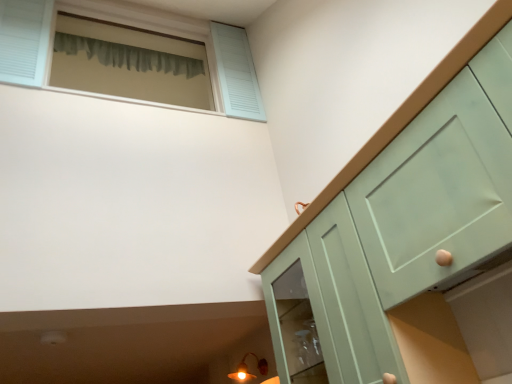
Question: Considering the positions of light blue wooden window at upper left and mint green cabinet at right in the image, is light blue wooden window at upper left bigger or smaller than mint green cabinet at right?

Choices:
 (A) small
 (B) big

Answer: (B)

Question: Is light blue wooden window at upper left inside the boundaries of mint green cabinet at right, or outside?

Choices:
 (A) inside
 (B) outside

Answer: (B)

Question: Which object is positioned closest to the matte gold light fixture at lower left?

Choices:
 (A) green fabric curtain at upper left
 (B) light blue wooden window at upper left
 (C) mint green cabinet at right
 (D) matte green cabinet at lower right

Answer: (D)

Question: Which of these objects is positioned farthest from the matte gold light fixture at lower left?

Choices:
 (A) matte green cabinet at lower right
 (B) light blue wooden window at upper left
 (C) mint green cabinet at right
 (D) green fabric curtain at upper left

Answer: (D)